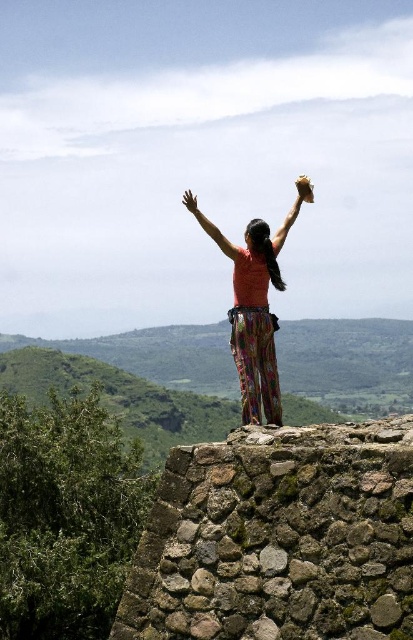
Question: Which object is closer to the camera taking this photo?

Choices:
 (A) matte pink arm at upper center
 (B) matte brown glove at upper center

Answer: (A)

Question: Can you confirm if rustic stone wall at center is bigger than matte skin hand at upper center?

Choices:
 (A) yes
 (B) no

Answer: (B)

Question: Which point is farther to the camera?

Choices:
 (A) matte brown glove at upper center
 (B) rustic stone wall at center
 (C) matte skin hand at upper center

Answer: (A)

Question: Can you confirm if matte orange shirt at center is thinner than matte pink arm at upper center?

Choices:
 (A) yes
 (B) no

Answer: (B)

Question: Among these points, which one is farthest from the camera?

Choices:
 (A) (275, 392)
 (B) (308, 200)
 (C) (213, 237)

Answer: (B)

Question: Does smooth skin hand at upper center appear over matte skin hand at upper center?

Choices:
 (A) no
 (B) yes

Answer: (B)